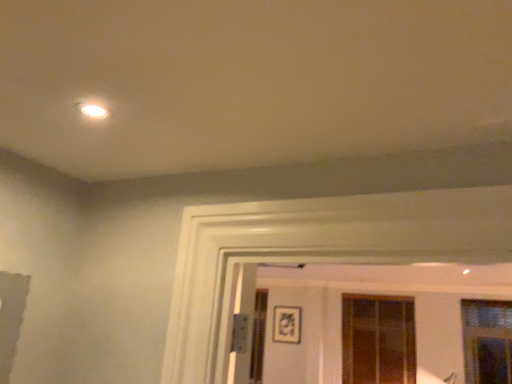
The width and height of the screenshot is (512, 384). What do you see at coordinates (378, 340) in the screenshot? I see `translucent glass window at center, which ranks as the first window in left-to-right order` at bounding box center [378, 340].

Find the location of a particular element. Image resolution: width=512 pixels, height=384 pixels. clear glass window at right, which is counted as the 1th window, starting from the right is located at coordinates (487, 341).

Where is `translucent glass window at center, which ranks as the first window in left-to-right order`? translucent glass window at center, which ranks as the first window in left-to-right order is located at coordinates (378, 340).

Considering the sizes of matte black picture frame at center and translucent glass window at center, acting as the 2th window starting from the right, in the image, is matte black picture frame at center taller or shorter than translucent glass window at center, acting as the 2th window starting from the right,?

Clearly, matte black picture frame at center is shorter compared to translucent glass window at center, acting as the 2th window starting from the right.

What's the angular difference between matte black picture frame at center and translucent glass window at center, acting as the 2th window starting from the right,'s facing directions?

The angular difference between matte black picture frame at center and translucent glass window at center, acting as the 2th window starting from the right, is 0.59 degrees.

Considering the relative positions of matte black picture frame at center and translucent glass window at center, the second window viewed from the front, in the image provided, is matte black picture frame at center to the left or to the right of translucent glass window at center, the second window viewed from the front,?

matte black picture frame at center is to the left of translucent glass window at center, the second window viewed from the front.

Based on the photo, can you confirm if matte black picture frame at center is bigger than translucent glass window at center, acting as the 2th window starting from the right?

No, matte black picture frame at center is not bigger than translucent glass window at center, acting as the 2th window starting from the right.

From the image's perspective, which is above, clear glass window at right, the 2th window from the left, or translucent glass window at center, acting as the 2th window starting from the right?

clear glass window at right, the 2th window from the left, appears higher in the image.

Can you confirm if clear glass window at right, which is counted as the 1th window, starting from the right, is bigger than translucent glass window at center, acting as the 2th window starting from the right?

No.

Between clear glass window at right, the 2th window from the left, and translucent glass window at center, which ranks as the first window in left-to-right order, which one has less height?

With less height is clear glass window at right, the 2th window from the left.

Is matte black picture frame at center oriented towards clear glass window at right, the first window viewed from the front?

No.

Is matte black picture frame at center smaller than clear glass window at right, the first window viewed from the front?

Yes, matte black picture frame at center is smaller than clear glass window at right, the first window viewed from the front.

Considering the relative sizes of matte black picture frame at center and clear glass window at right, the first window viewed from the front, in the image provided, is matte black picture frame at center wider than clear glass window at right, the first window viewed from the front,?

No, matte black picture frame at center is not wider than clear glass window at right, the first window viewed from the front.

Is matte black picture frame at center touching clear glass window at right, arranged as the 2th window when viewed from the back?

No, matte black picture frame at center is not in contact with clear glass window at right, arranged as the 2th window when viewed from the back.

Is clear glass window at right, the 2th window from the left, bigger than matte black picture frame at center?

Yes.

Is clear glass window at right, the first window viewed from the front, not near matte black picture frame at center?

clear glass window at right, the first window viewed from the front, is positioned a significant distance from matte black picture frame at center.

From a real-world perspective, is clear glass window at right, which is counted as the 1th window, starting from the right, positioned under matte black picture frame at center based on gravity?

Indeed, from a real-world perspective, clear glass window at right, which is counted as the 1th window, starting from the right, is positioned beneath matte black picture frame at center.

Can you confirm if clear glass window at right, which is counted as the 1th window, starting from the right, is shorter than matte black picture frame at center?

In fact, clear glass window at right, which is counted as the 1th window, starting from the right, may be taller than matte black picture frame at center.

Is translucent glass window at center, acting as the 2th window starting from the right, facing towards matte black picture frame at center?

No.

Does translucent glass window at center, which ranks as the first window in left-to-right order, touch matte black picture frame at center?

No, translucent glass window at center, which ranks as the first window in left-to-right order, is not beside matte black picture frame at center.

This screenshot has height=384, width=512. Find the location of `picture frame on the left of translucent glass window at center, acting as the 2th window starting from the right`. picture frame on the left of translucent glass window at center, acting as the 2th window starting from the right is located at coordinates (287, 324).

From a real-world perspective, which object rests below the other?

translucent glass window at center, which ranks as the first window in left-to-right order.

Which of these two, translucent glass window at center, which ranks as the first window in left-to-right order, or clear glass window at right, the 2th window from the left, stands shorter?

clear glass window at right, the 2th window from the left, is shorter.

From the image's perspective, which object appears higher, translucent glass window at center, the second window viewed from the front, or clear glass window at right, the first window viewed from the front?

clear glass window at right, the first window viewed from the front.

Is translucent glass window at center, arranged as the first window when viewed from the back, to the left of clear glass window at right, arranged as the 2th window when viewed from the back, from the viewer's perspective?

Yes, translucent glass window at center, arranged as the first window when viewed from the back, is to the left of clear glass window at right, arranged as the 2th window when viewed from the back.

Does translucent glass window at center, acting as the 2th window starting from the right, have a greater width compared to clear glass window at right, the 2th window from the left?

Yes.

From a real-world perspective, starting from the matte black picture frame at center, which window is the 2nd one below it? Please provide its 2D coordinates.

[(378, 340)]

The height and width of the screenshot is (384, 512). There is a translucent glass window at center, the second window viewed from the front. What are the coordinates of `window above it (from a real-world perspective)` in the screenshot? It's located at (487, 341).

Based on their spatial positions, is matte black picture frame at center or clear glass window at right, the first window viewed from the front, closer to translucent glass window at center, which ranks as the first window in left-to-right order?

Among the two, clear glass window at right, the first window viewed from the front, is located nearer to translucent glass window at center, which ranks as the first window in left-to-right order.

When comparing their distances from matte black picture frame at center, does translucent glass window at center, acting as the 2th window starting from the right, or clear glass window at right, the 2th window from the left, seem further?

clear glass window at right, the 2th window from the left, is further to matte black picture frame at center.

When comparing their distances from clear glass window at right, the 2th window from the left, does translucent glass window at center, arranged as the first window when viewed from the back, or matte black picture frame at center seem closer?

translucent glass window at center, arranged as the first window when viewed from the back.

Looking at the image, which one is located further to matte black picture frame at center, clear glass window at right, arranged as the 2th window when viewed from the back, or translucent glass window at center, which ranks as the first window in left-to-right order?

clear glass window at right, arranged as the 2th window when viewed from the back, is positioned further to the anchor matte black picture frame at center.

When comparing their distances from clear glass window at right, arranged as the 2th window when viewed from the back, does matte black picture frame at center or translucent glass window at center, which ranks as the first window in left-to-right order, seem further?

matte black picture frame at center is further to clear glass window at right, arranged as the 2th window when viewed from the back.

Considering their positions, is clear glass window at right, the 2th window from the left, positioned further to translucent glass window at center, arranged as the first window when viewed from the back, than matte black picture frame at center?

matte black picture frame at center.

The width and height of the screenshot is (512, 384). Find the location of `window situated between matte black picture frame at center and clear glass window at right, arranged as the 2th window when viewed from the back, from left to right`. window situated between matte black picture frame at center and clear glass window at right, arranged as the 2th window when viewed from the back, from left to right is located at coordinates (378, 340).